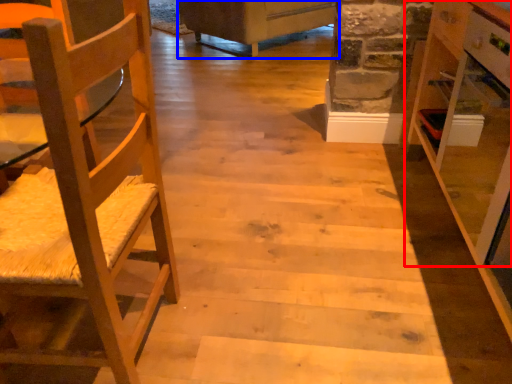
Question: Which object appears farthest to the camera in this image, cabinetry (highlighted by a red box) or furniture (highlighted by a blue box)?

Choices:
 (A) cabinetry
 (B) furniture

Answer: (B)